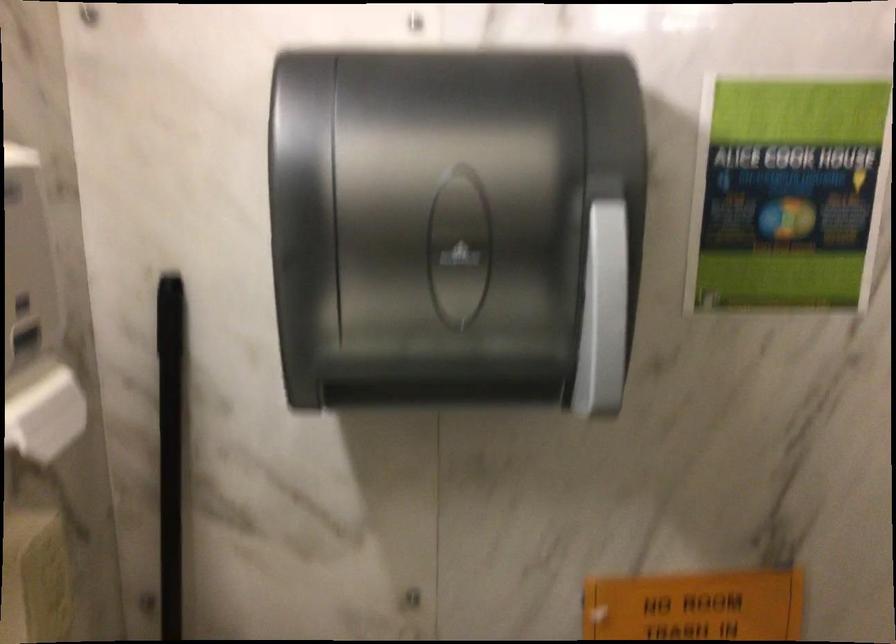
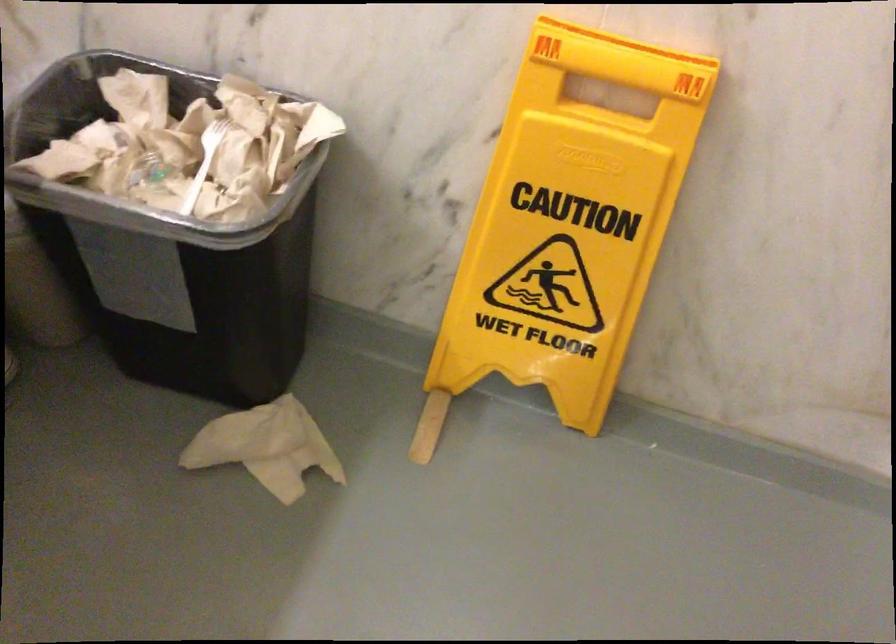
Question: How did the camera likely rotate?

Choices:
 (A) Left
 (B) Right
 (C) Up
 (D) Down

Answer: (D)